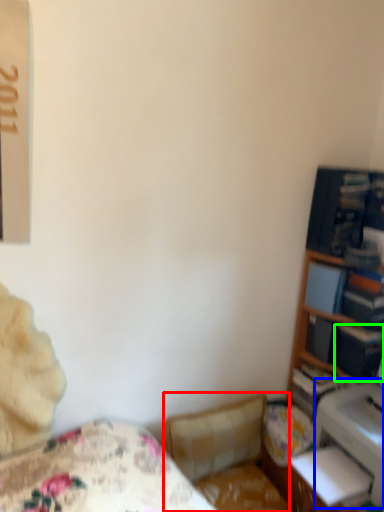
Question: Estimate the real-world distances between objects in this image. Which object is farther from swivel chair (highlighted by a red box), printer (highlighted by a blue box) or paperback book (highlighted by a green box)?

Choices:
 (A) printer
 (B) paperback book

Answer: (B)